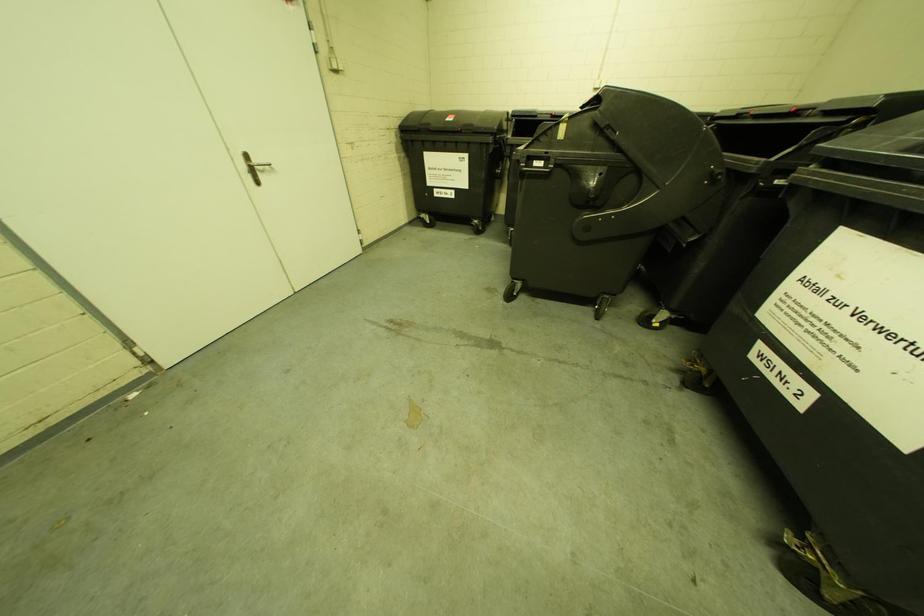
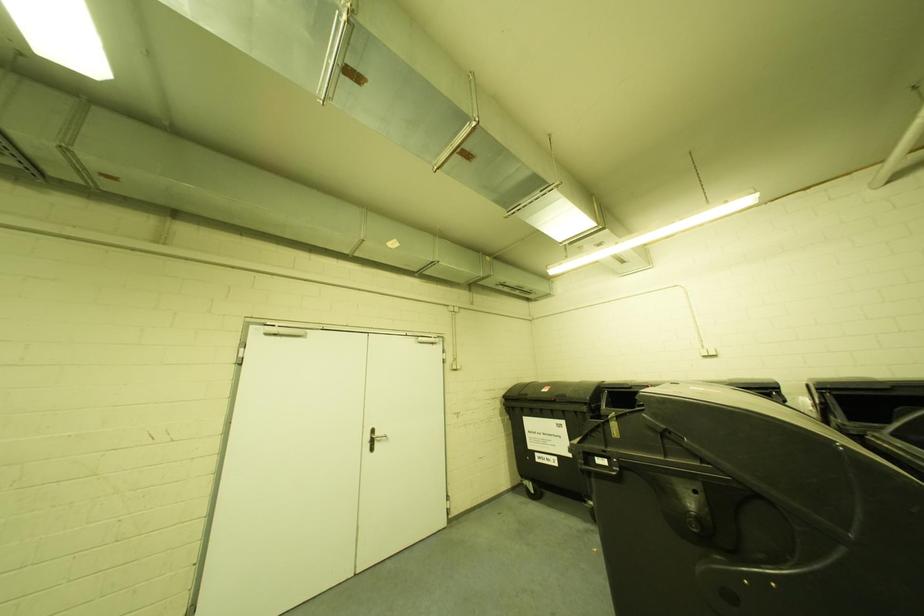
In the scene shown: Based on the continuous images, in which direction is the camera rotating?

The camera's rotation is toward left-up.